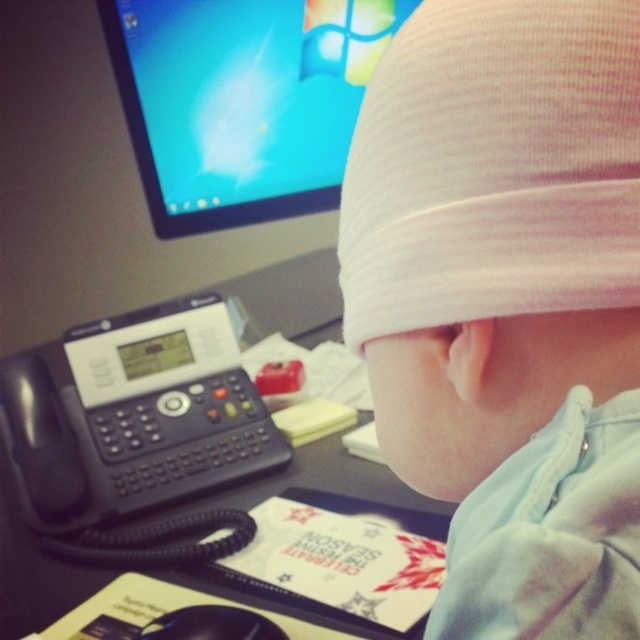
You are organizing items on a desk and need to place a new item between the white fabric hat at upper center and the black plastic phone at left. Based on their current positions, where should you place the new item?

The white fabric hat at upper center is positioned on the right side of the black plastic phone at left, so you should place the new item between them, to the right of the black plastic phone at left and to the left of the white fabric hat at upper center.

You are trying to locate the black plastic phone at left on the desk. According to the coordinates provided, where is it positioned relative to the center of the desk?

The black plastic phone at left is located at coordinates point (x=132, y=424), which is to the right and slightly above the center of the desk.

You are organizing the desk items and need to place a new item between the matte plastic monitor at upper center and the black plastic phone at left. Is there vertical space between them to fit a 5cm tall item?

The matte plastic monitor at upper center is above the black plastic phone at left, so there is vertical space between them. A 5cm tall item can be placed in between as long as it fits within that space.